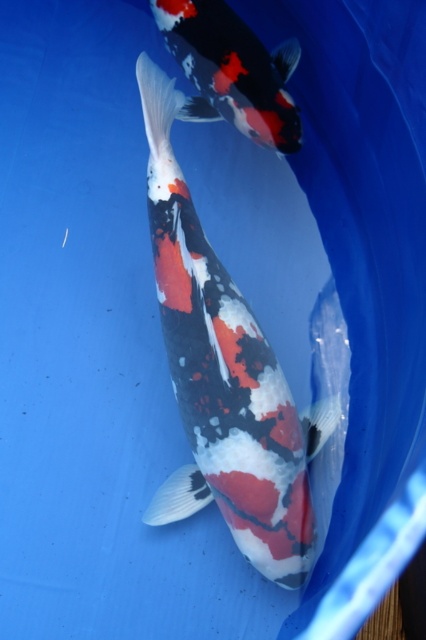
Question: Is speckled white and black fish at center smaller than speckled white and black fish at upper center?

Choices:
 (A) no
 (B) yes

Answer: (A)

Question: Does speckled white and black fish at center have a lesser width compared to speckled white and black fish at upper center?

Choices:
 (A) yes
 (B) no

Answer: (B)

Question: Does speckled white and black fish at center appear on the left side of speckled white and black fish at upper center?

Choices:
 (A) yes
 (B) no

Answer: (A)